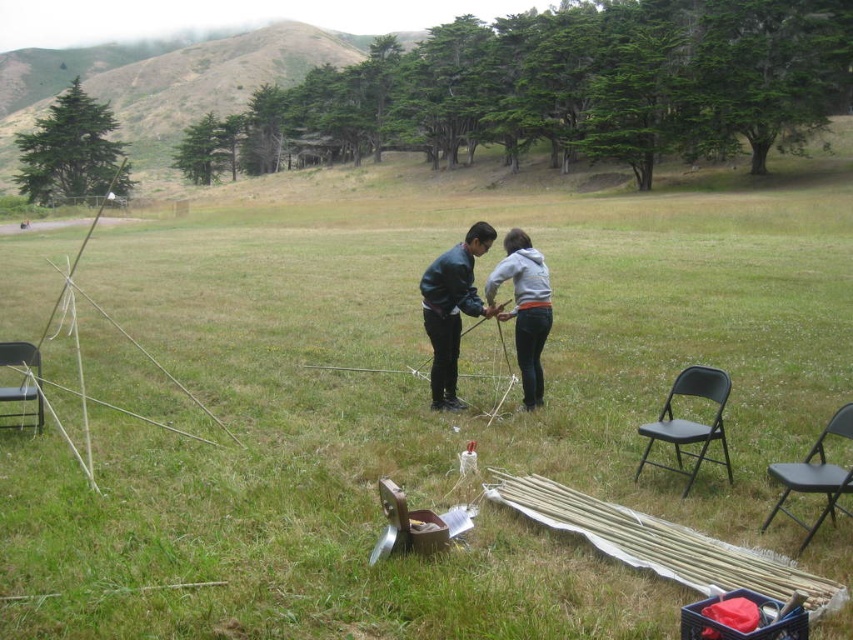
Is black plastic chair at lower right thinner than black metal chair at left?

Correct, black plastic chair at lower right's width is less than black metal chair at left's.

What do you see at coordinates (815, 476) in the screenshot? The width and height of the screenshot is (853, 640). I see `black plastic chair at lower right` at bounding box center [815, 476].

Is point (833, 522) positioned after point (39, 422)?

No.

Find the location of a particular element. black plastic chair at lower right is located at coordinates (815, 476).

Is matte black jacket at center wider than gray fleece hoodie at center?

Correct, the width of matte black jacket at center exceeds that of gray fleece hoodie at center.

How far apart are matte black jacket at center and gray fleece hoodie at center?

matte black jacket at center is 19.13 centimeters away from gray fleece hoodie at center.

Identify the location of matte black jacket at center. This screenshot has height=640, width=853. (492, 296).

Is point (491, 292) behind point (4, 365)?

No.

Who is taller, gray fleece hoodie at center or black metal chair at left?

black metal chair at left

Locate an element on the screen. This screenshot has width=853, height=640. gray fleece hoodie at center is located at coordinates (525, 308).

Where is `gray fleece hoodie at center`? Image resolution: width=853 pixels, height=640 pixels. gray fleece hoodie at center is located at coordinates (525, 308).